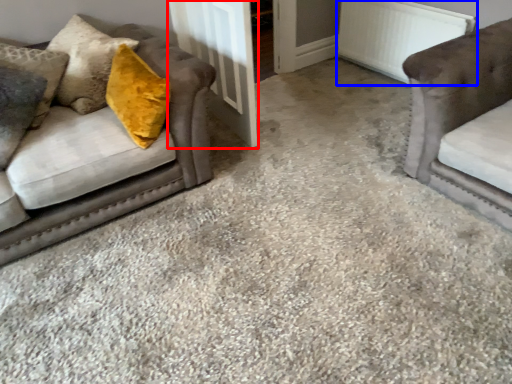
Question: Which point is closer to the camera, door (highlighted by a red box) or radiator (highlighted by a blue box)?

Choices:
 (A) door
 (B) radiator

Answer: (A)